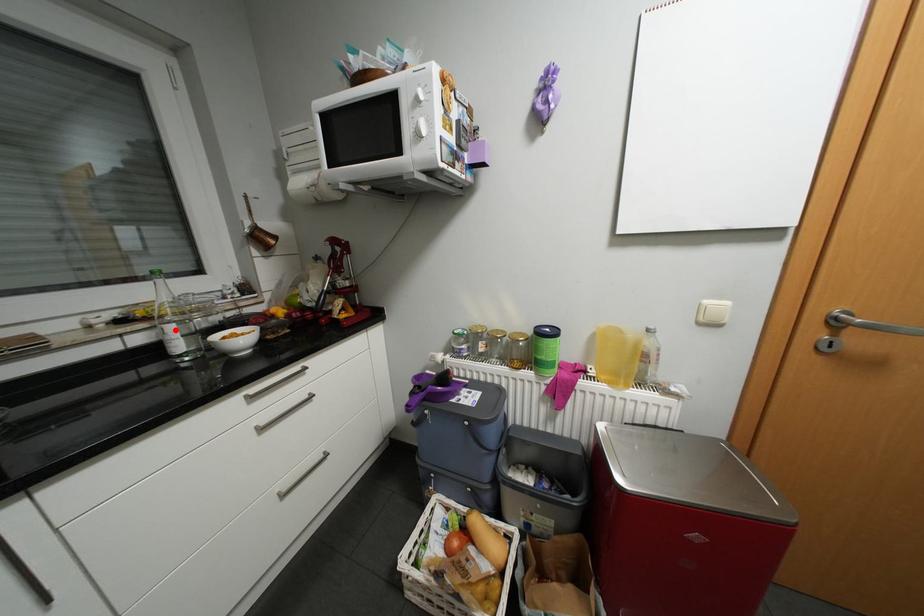
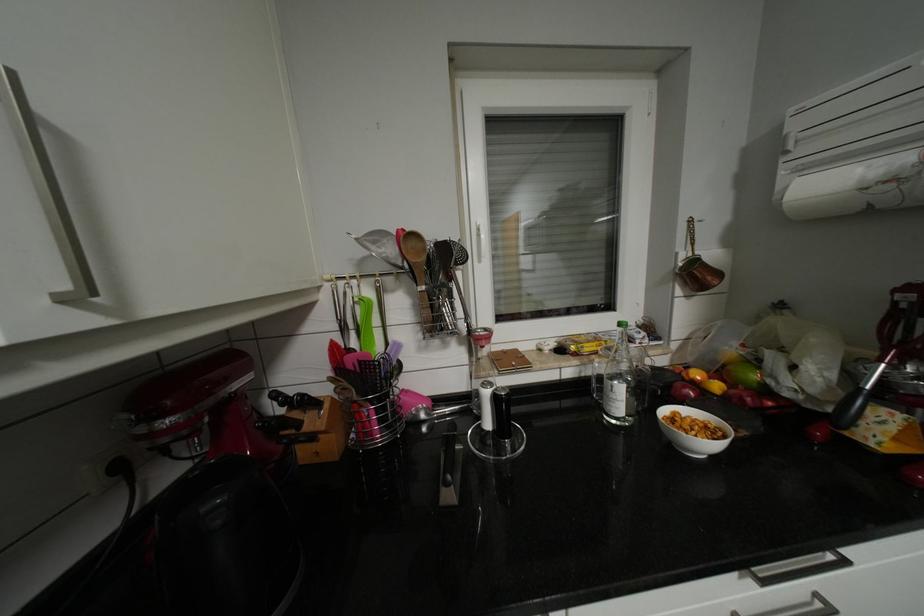
In the second image, find the point that corresponds to the highlighted location in the first image.

(623, 387)